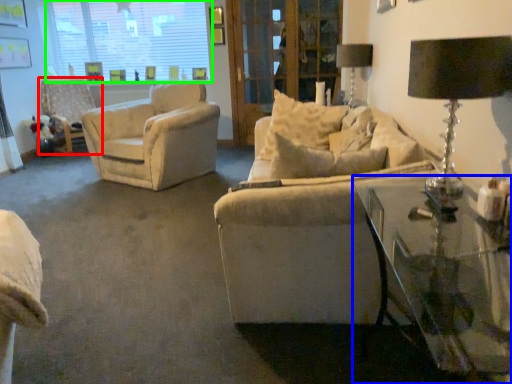
Question: Which object is positioned closest to chair (highlighted by a red box)? Select from table (highlighted by a blue box) and window (highlighted by a green box).

Choices:
 (A) table
 (B) window

Answer: (B)